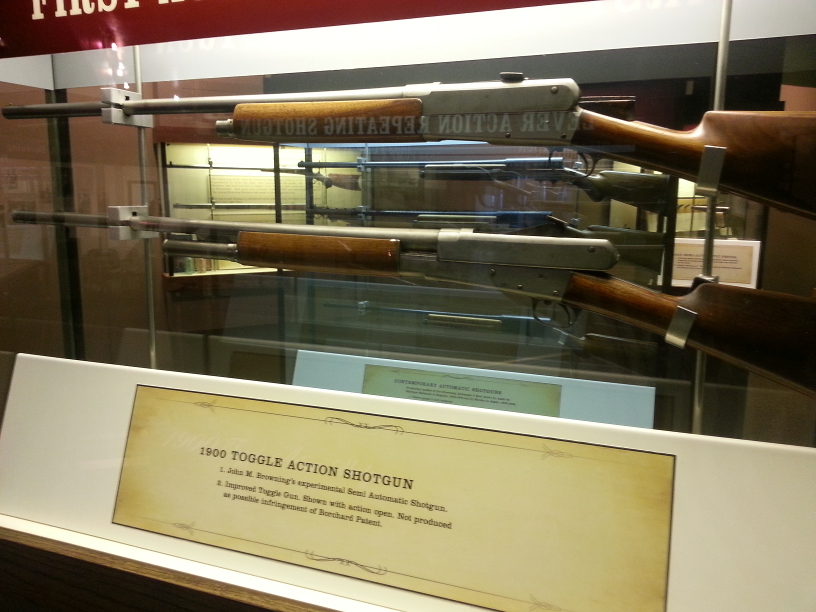
This screenshot has height=612, width=816. I want to click on plaque, so click(449, 392).